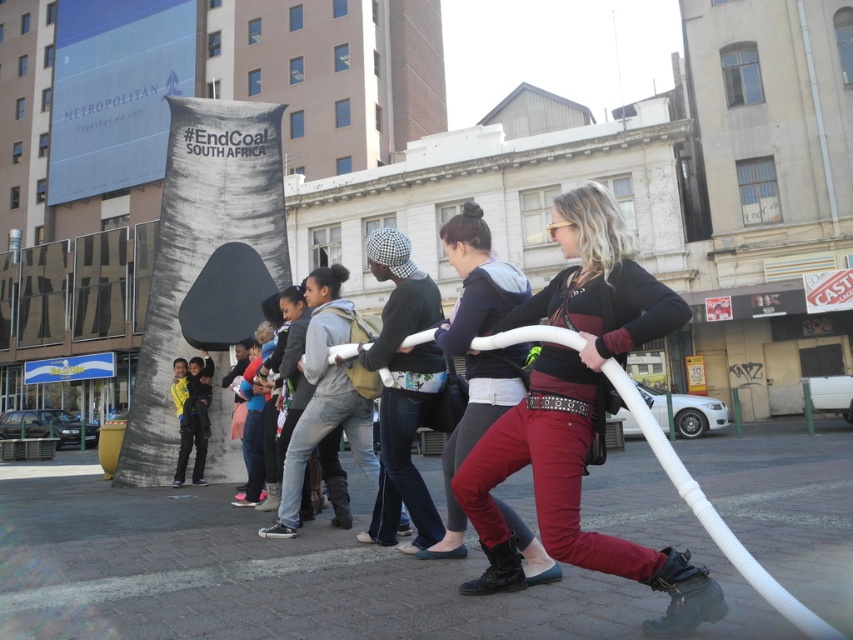
Question: Does matte black pants at center lie behind black cotton shirt at center?

Choices:
 (A) no
 (B) yes

Answer: (A)

Question: Which point appears farthest from the camera in this image?

Choices:
 (A) (384, 324)
 (B) (572, 296)
 (C) (358, 625)
 (D) (508, 284)

Answer: (A)

Question: Which object is the farthest from the black cotton shirt at center?

Choices:
 (A) brick pavement at lower center
 (B) matte black jacket at center
 (C) matte black pants at center

Answer: (A)

Question: Can you confirm if matte black jacket at center is positioned to the left of matte black pants at center?

Choices:
 (A) yes
 (B) no

Answer: (B)

Question: Observing the image, what is the correct spatial positioning of matte black jacket at center in reference to black cotton shirt at center?

Choices:
 (A) right
 (B) left

Answer: (A)

Question: Which of the following is the farthest from the observer?

Choices:
 (A) (13, 492)
 (B) (672, 324)
 (C) (482, 316)

Answer: (A)